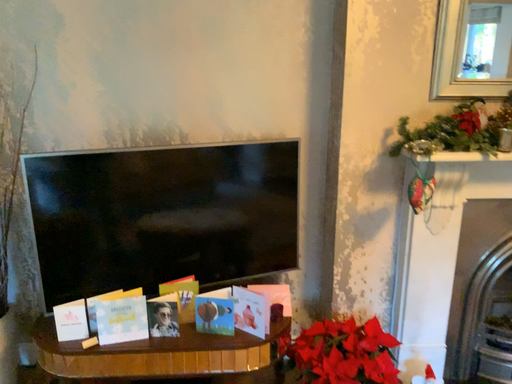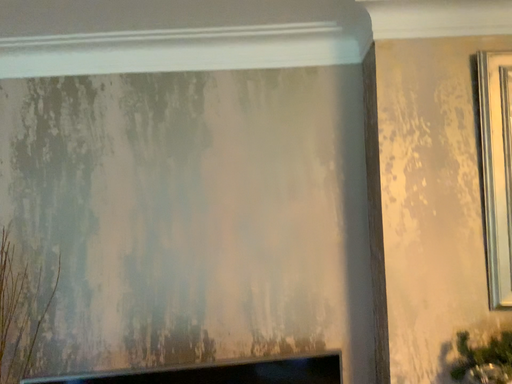
Question: Which way did the camera rotate in the video?

Choices:
 (A) rotated upward
 (B) rotated downward

Answer: (A)